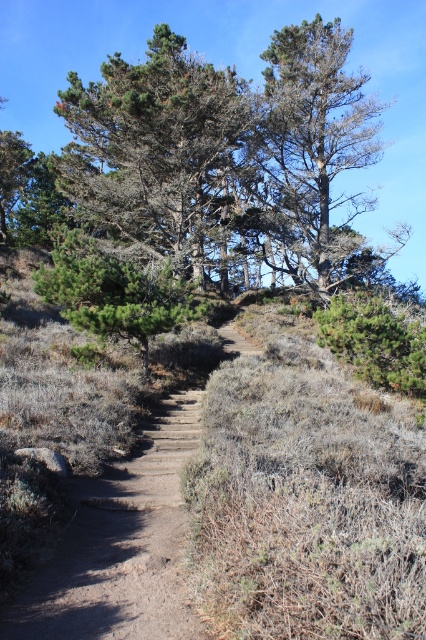
Can you confirm if dirt path at center is positioned below green needle-like tree at center?

Indeed, dirt path at center is positioned under green needle-like tree at center.

Can you confirm if dirt path at center is positioned to the right of green needle-like tree at center?

Correct, you'll find dirt path at center to the right of green needle-like tree at center.

Does point (181, 611) come in front of point (83, 276)?

Yes, it is.

At what (x,y) coordinates should I click in order to perform the action: click on dirt path at center. Please return your answer as a coordinate pair (x, y). Looking at the image, I should click on (120, 545).

Consider the image. Does green needle-like tree at upper center appear on the left side of dirt path at center?

A: Indeed, green needle-like tree at upper center is positioned on the left side of dirt path at center.

Is point (149, 115) positioned after point (81, 544)?

Yes, point (149, 115) is behind point (81, 544).

Who is more distant from viewer, (x=221, y=163) or (x=158, y=552)?

The point (x=221, y=163) is behind.

You are a GUI agent. You are given a task and a screenshot of the screen. Output one action in this format:
    pyautogui.click(x=<x>, y=<y>)
    Task: Click on the green needle-like tree at upper center
    This screenshot has height=640, width=426.
    Given the screenshot: What is the action you would take?
    pyautogui.click(x=160, y=156)

Does green needle-like tree at upper center come behind green needle-like at upper center?

No, it is in front of green needle-like at upper center.

What do you see at coordinates (160, 156) in the screenshot? I see `green needle-like tree at upper center` at bounding box center [160, 156].

You are a GUI agent. You are given a task and a screenshot of the screen. Output one action in this format:
    pyautogui.click(x=<x>, y=<y>)
    Task: Click on the green needle-like tree at upper center
    This screenshot has width=426, height=640.
    Given the screenshot: What is the action you would take?
    pyautogui.click(x=160, y=156)